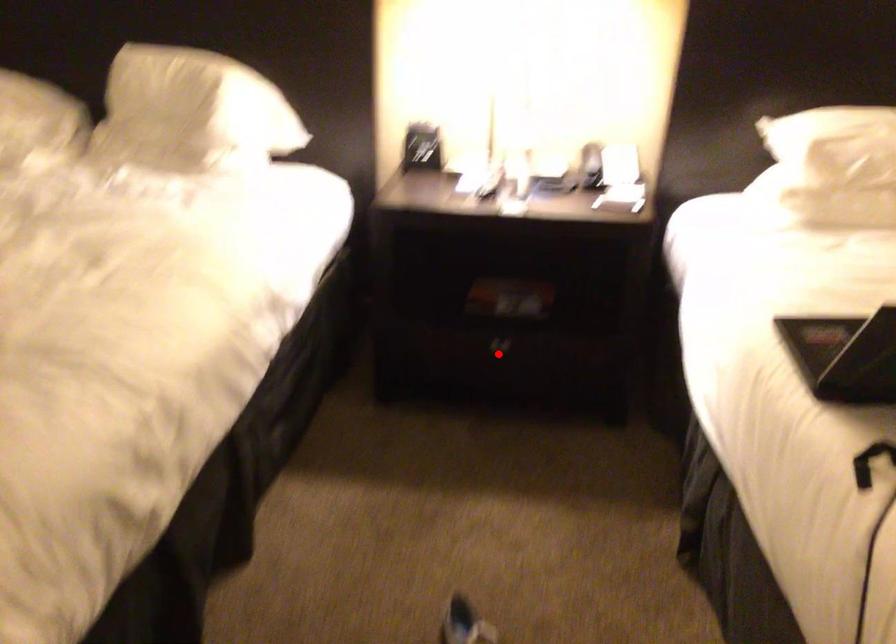
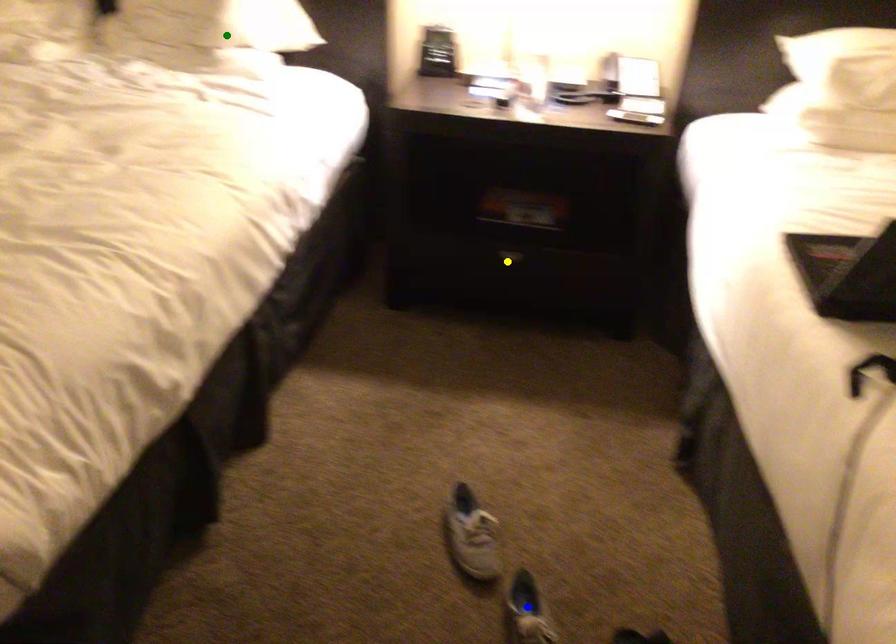
Question: I am providing you with two images of the same scene from different viewpoints. A red point is marked on the first image. You are given multiple points on the second image. Which spot in image 2 lines up with the point in image 1?

Choices:
 (A) blue point
 (B) yellow point
 (C) green point

Answer: (B)